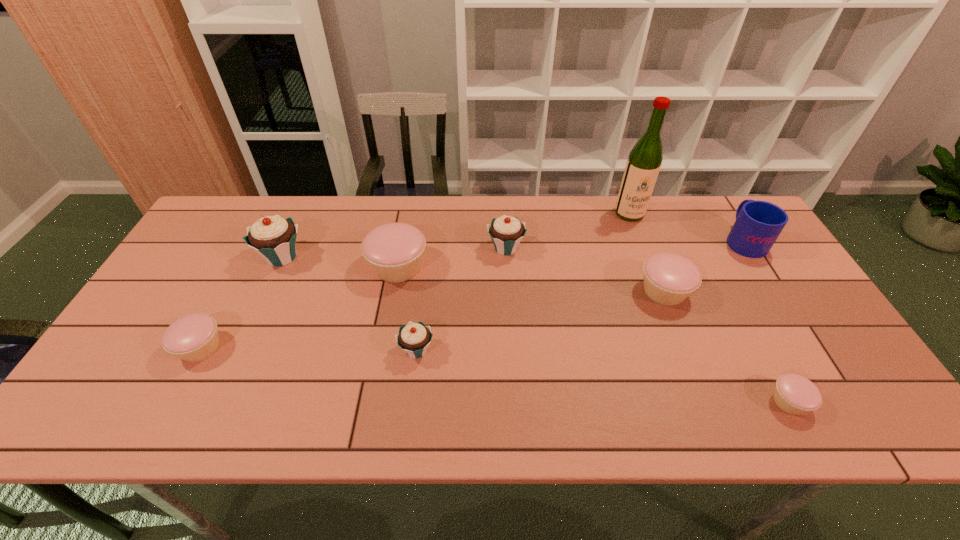
At what (x,y) coordinates should I click in order to perform the action: click on the second cupcake from right to left. Please return your answer as a coordinate pair (x, y). The height and width of the screenshot is (540, 960). Looking at the image, I should click on (669, 278).

Image resolution: width=960 pixels, height=540 pixels. Identify the location of the smallest teal cupcake. (414, 338).

This screenshot has height=540, width=960. I want to click on the nearest teal cupcake, so click(x=414, y=338).

Where is `the third biggest pink cupcake`? the third biggest pink cupcake is located at coordinates (194, 337).

Locate an element on the screen. This screenshot has width=960, height=540. the third farthest pink cupcake is located at coordinates (194, 337).

Find the location of `the nearest object`. the nearest object is located at coordinates (794, 394).

What are the coordinates of `the rightmost cupcake` in the screenshot? It's located at (794, 394).

The height and width of the screenshot is (540, 960). I want to click on free location located 0.270m on the label of the tallest object, so click(656, 284).

I want to click on free location located on the front of the eighth shortest object, so point(268,288).

The image size is (960, 540). What are the coordinates of `vacant space located 0.110m on the side with the handle of the mug` in the screenshot? It's located at (720, 202).